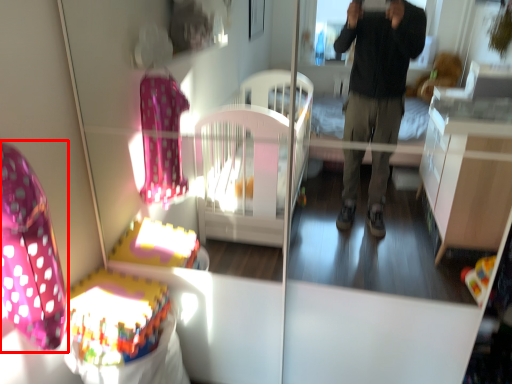
Question: From the image's perspective, considering the relative positions of swivel chair (annotated by the red box) and baby carriage in the image provided, where is swivel chair (annotated by the red box) located with respect to the staircase?

Choices:
 (A) above
 (B) below

Answer: (A)